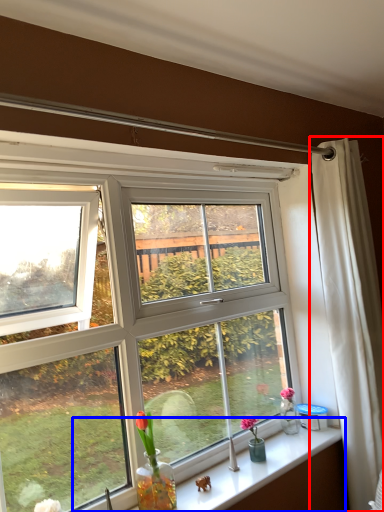
Question: Which object is further to the camera taking this photo, curtain (highlighted by a red box) or window sill (highlighted by a blue box)?

Choices:
 (A) curtain
 (B) window sill

Answer: (A)